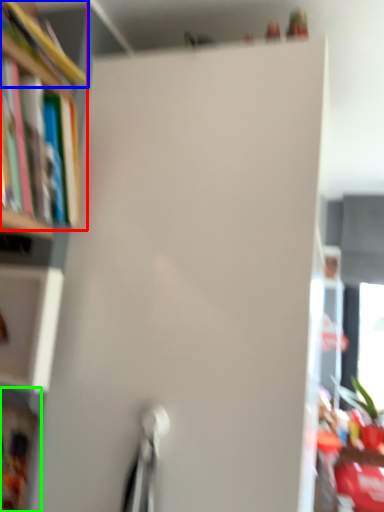
Question: Which is farther away from book (highlighted by a red box)? book (highlighted by a blue box) or cabinet (highlighted by a green box)?

Choices:
 (A) book
 (B) cabinet

Answer: (B)